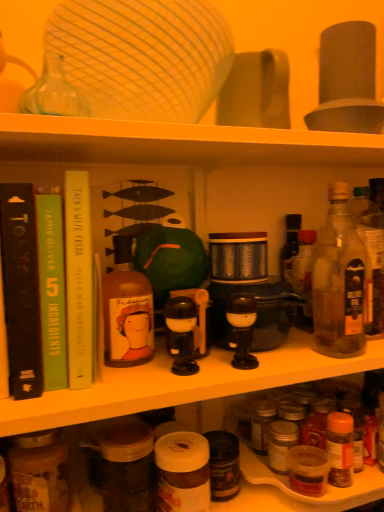
Question: Choose the correct answer: Is black plastic toy at center inside matte black coffee machine at center or outside it?

Choices:
 (A) outside
 (B) inside

Answer: (A)

Question: From a real-world perspective, is black plastic toy at center above or below matte black coffee machine at center?

Choices:
 (A) below
 (B) above

Answer: (A)

Question: Which is farther from the clear glass bottle at right, which appears as the third bottle when viewed from the left?

Choices:
 (A) brown glass jar at lower left, acting as the 1th bottle starting from the left
 (B) matte black coffee machine at center
 (C) translucent glass bottle at right, placed as the 4th bottle when sorted from left to right
 (D) green paperback book at left, positioned as the 2th book in right-to-left order
 (E) translucent plastic spice jar at lower center

Answer: (A)

Question: Considering the real-world distances, which object is farthest from the black plastic toy at center?

Choices:
 (A) brown glass jar at lower left, positioned as the fourth bottle in right-to-left order
 (B) matte black coffee machine at center
 (C) translucent plastic spice jar at lower center
 (D) yellow paperback book at upper left, which is the first book in right-to-left order
 (E) translucent glass bottle at right, placed as the 4th bottle when sorted from left to right

Answer: (E)